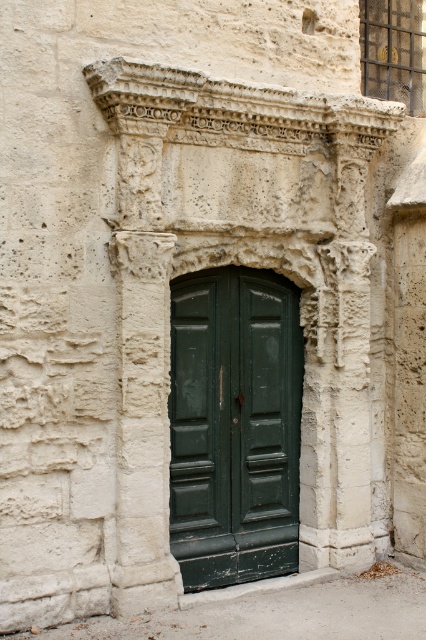
Is carved stone arch at center bigger than green wooden door at center?

Yes, carved stone arch at center is bigger than green wooden door at center.

Between carved stone arch at center and green wooden door at center, which one has less height?

green wooden door at center

Where is `carved stone arch at center`? Image resolution: width=426 pixels, height=640 pixels. carved stone arch at center is located at coordinates (238, 308).